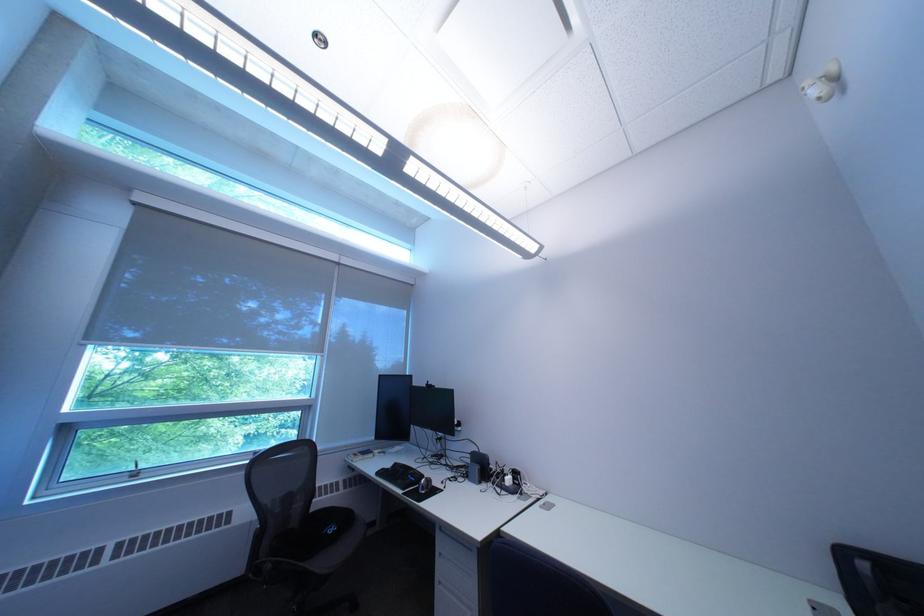
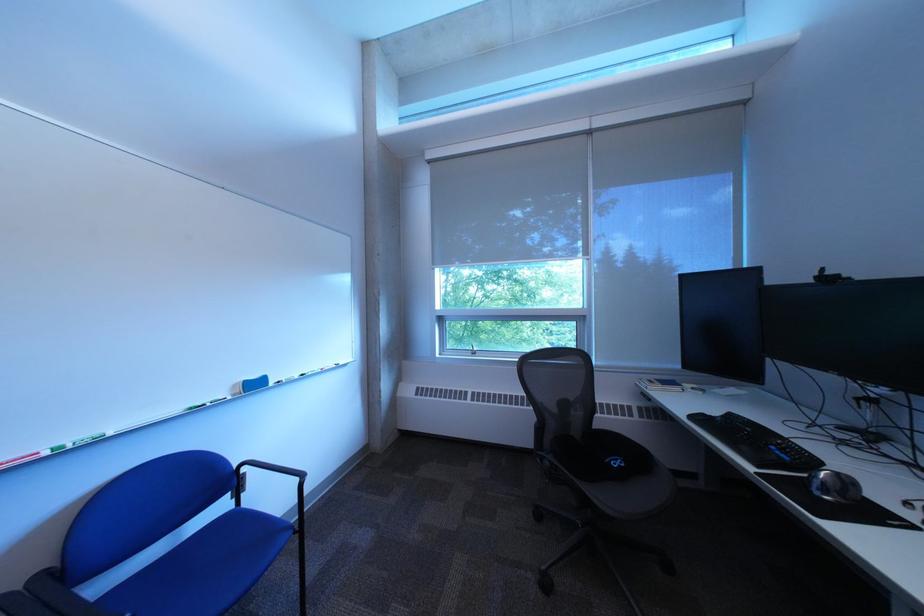
Question: Based on the continuous images, in which direction is the camera rotating? Reply with the corresponding letter.

Choices:
 (A) Left
 (B) Right
 (C) Up
 (D) Down

Answer: (A)